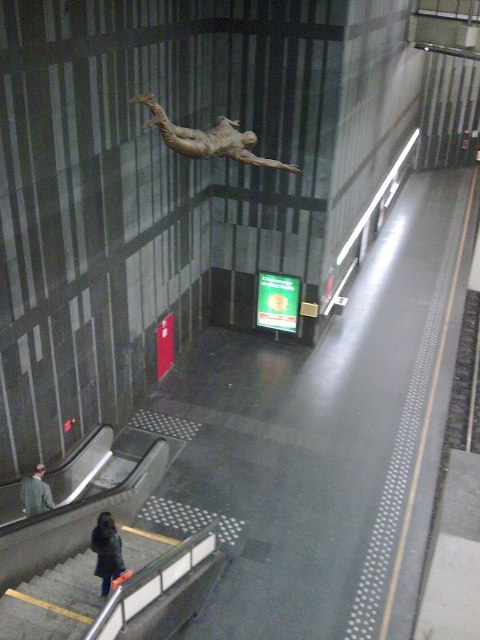
Question: Is gray concrete stairs at lower left above bronze statue at upper center?

Choices:
 (A) yes
 (B) no

Answer: (B)

Question: Does gray concrete stairs at lower left appear on the right side of gray wool coat at lower left?

Choices:
 (A) no
 (B) yes

Answer: (B)

Question: Is gray concrete stairs at lower left bigger than gray wool coat at lower left?

Choices:
 (A) no
 (B) yes

Answer: (B)

Question: Which of the following is the closest to the observer?

Choices:
 (A) gray concrete stairs at lower left
 (B) bronze statue at upper center
 (C) gray wool coat at lower left
 (D) dark gray jacket at lower left

Answer: (A)

Question: Which object appears closest to the camera in this image?

Choices:
 (A) dark gray jacket at lower left
 (B) bronze statue at upper center
 (C) gray wool coat at lower left
 (D) gray concrete stairs at lower left

Answer: (D)

Question: Which point is closer to the camera?

Choices:
 (A) bronze statue at upper center
 (B) gray concrete stairs at lower left
 (C) gray wool coat at lower left

Answer: (B)